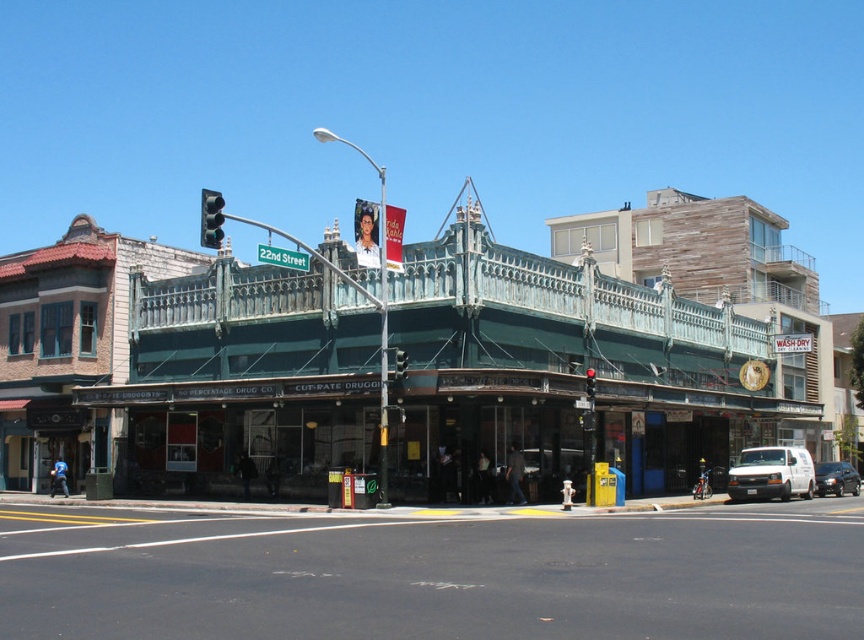
Question: Is green metal awning at center wider than green glass traffic light at upper center?

Choices:
 (A) yes
 (B) no

Answer: (B)

Question: Does green metal awning at center appear under red glass traffic light at upper center?

Choices:
 (A) yes
 (B) no

Answer: (B)

Question: Is white matte van at center above green glass traffic light at upper center?

Choices:
 (A) no
 (B) yes

Answer: (A)

Question: Which point is farther to the camera?

Choices:
 (A) shiny black sedan at center
 (B) green metal awning at center
 (C) black asphalt at lower center

Answer: (A)

Question: Which object is positioned farthest from the black asphalt at lower center?

Choices:
 (A) green metal awning at center
 (B) metallic traffic light at center
 (C) red glass traffic light at upper center

Answer: (A)

Question: Which is nearer to the red glass traffic light at upper center?

Choices:
 (A) green metal awning at center
 (B) metallic traffic light at center
 (C) green glass traffic light at upper center

Answer: (B)